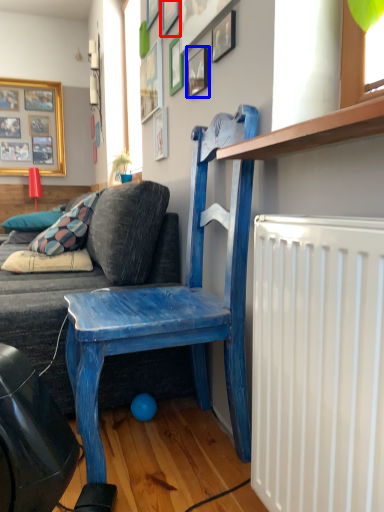
Question: Among these objects, which one is nearest to the camera, picture frame (highlighted by a red box) or picture frame (highlighted by a blue box)?

Choices:
 (A) picture frame
 (B) picture frame

Answer: (B)